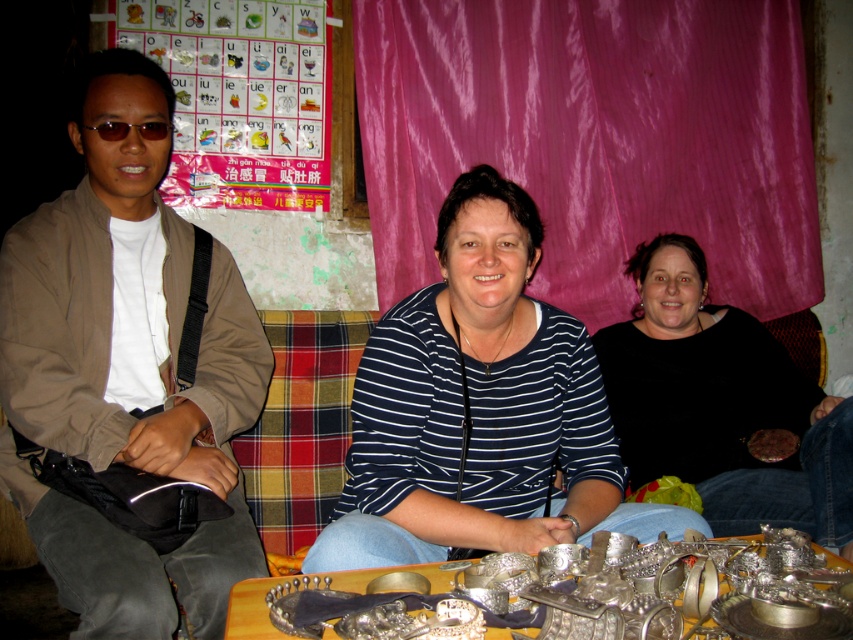
At what (x,y) coordinates should I click in order to perform the action: click on brown fabric jacket at left. Please return your answer as a coordinate pair (x, y). Looking at the image, I should click on (125, 365).

Between point (219, 312) and point (718, 323), which one is positioned behind?

The point (718, 323) is more distant.

Who is more forward, (4, 307) or (757, 508)?

Point (4, 307) is more forward.

Find the location of a particular element. Image resolution: width=853 pixels, height=640 pixels. brown fabric jacket at left is located at coordinates (125, 365).

Which of these two, brown fabric jacket at left or metallic silver jewelry at lower center, stands taller?

brown fabric jacket at left

Who is more forward, (184,314) or (412,568)?

Point (412,568)

Where is `brown fabric jacket at left`? This screenshot has height=640, width=853. brown fabric jacket at left is located at coordinates (125, 365).

Can you confirm if blue striped shirt at center is positioned to the left of metallic silver jewelry at lower center?

No, blue striped shirt at center is not to the left of metallic silver jewelry at lower center.

Between blue striped shirt at center and metallic silver jewelry at lower center, which one appears on the left side from the viewer's perspective?

metallic silver jewelry at lower center

Is point (457, 346) in front of point (236, 627)?

That is False.

What are the coordinates of `blue striped shirt at center` in the screenshot? It's located at (479, 410).